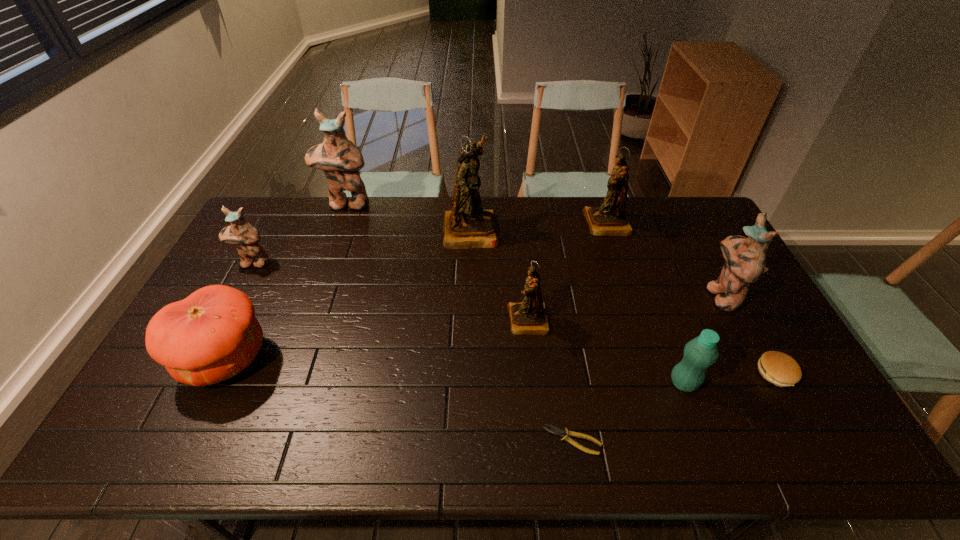
At what (x,y) coordinates should I click in order to perform the action: click on free point at the far edge. Please return your answer as a coordinate pair (x, y). Image resolution: width=960 pixels, height=540 pixels. Looking at the image, I should click on (575, 220).

Identify the location of free location at the near edge of the desktop. The image size is (960, 540). (682, 442).

Where is `free region at the left edge of the desktop`? The image size is (960, 540). free region at the left edge of the desktop is located at coordinates (156, 381).

In the image, there is a desktop. At what (x,y) coordinates should I click in order to perform the action: click on free space at the right edge. Please return your answer as a coordinate pair (x, y). Looking at the image, I should click on (690, 242).

This screenshot has width=960, height=540. I want to click on vacant space at the far left corner of the desktop, so click(259, 217).

Where is `vacant point at the near left corner`? The width and height of the screenshot is (960, 540). vacant point at the near left corner is located at coordinates (148, 433).

Locate an element on the screen. The image size is (960, 540). free spot at the far right corner of the desktop is located at coordinates (684, 232).

Image resolution: width=960 pixels, height=540 pixels. Find the location of `empty location between the leftmost pink figurine and the water bottle`. empty location between the leftmost pink figurine and the water bottle is located at coordinates (468, 323).

The image size is (960, 540). I want to click on vacant region between the biggest pink figurine and the third nearest figurine, so click(300, 234).

The image size is (960, 540). Identify the location of free spot between the water bottle and the second pink figurine from right to left. (515, 294).